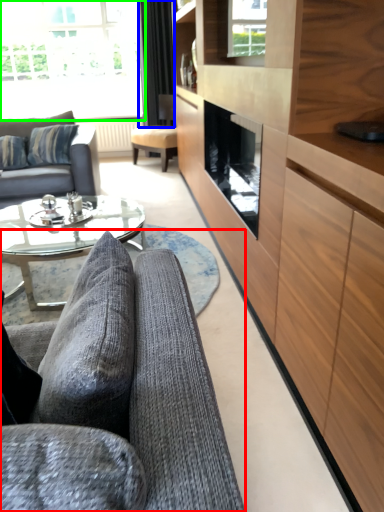
Question: Which object is positioned farthest from studio couch (highlighted by a red box)? Select from curtain (highlighted by a blue box) and window (highlighted by a green box).

Choices:
 (A) curtain
 (B) window

Answer: (B)